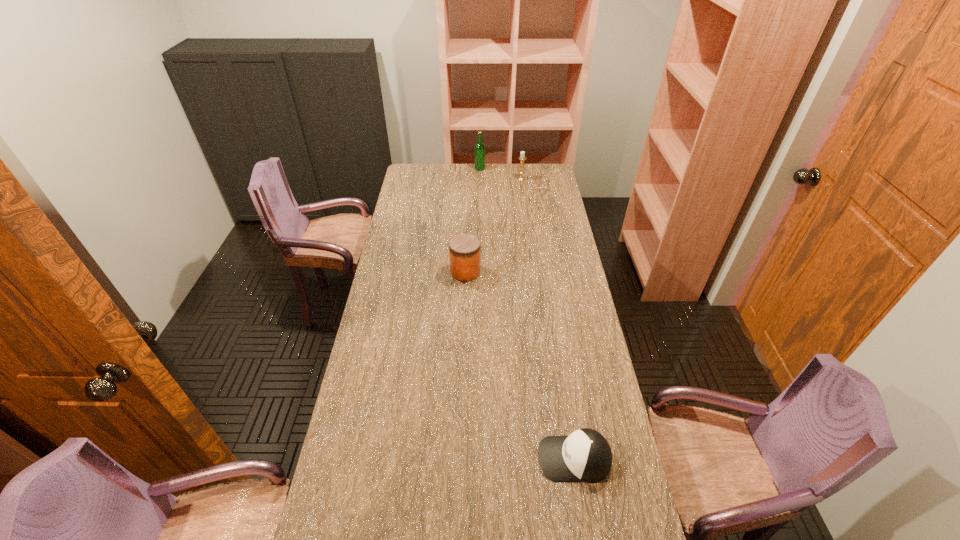
The width and height of the screenshot is (960, 540). I want to click on vacant space that is in between the farthest object and the jar, so click(472, 220).

Identify which object is the third closest to the nearest object. Please provide its 2D coordinates. Your answer should be formatted as a tuple, i.e. [(x, y)], where the tuple contains the x and y coordinates of a point satisfying the conditions above.

[(479, 150)]

Select which object appears as the second closest to the cap. Please provide its 2D coordinates. Your answer should be formatted as a tuple, i.e. [(x, y)], where the tuple contains the x and y coordinates of a point satisfying the conditions above.

[(522, 157)]